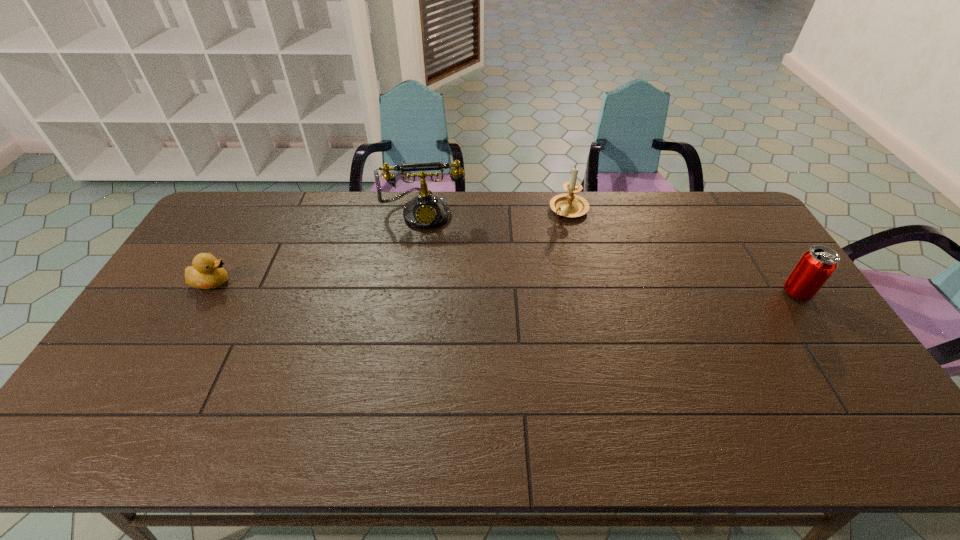
In order to click on vacant space located with a handle on the side of the third object from left to right in this screenshot , I will do `click(539, 241)`.

The width and height of the screenshot is (960, 540). I want to click on vacant space situated 0.210m on the dial of the third object from right to left, so click(x=425, y=273).

In order to click on vacant region located 0.290m on the dial of the third object from right to left in this screenshot , I will do `click(425, 292)`.

You are a GUI agent. You are given a task and a screenshot of the screen. Output one action in this format:
    pyautogui.click(x=<x>, y=<y>)
    Task: Click on the vacant space situated 0.390m on the dial of the third object from right to left
    
    Given the screenshot: What is the action you would take?
    pyautogui.click(x=425, y=318)

Locate an element on the screen. The height and width of the screenshot is (540, 960). candle holder that is positioned at the far edge is located at coordinates (568, 205).

Locate an element on the screen. telephone that is at the far edge is located at coordinates (425, 211).

Find the location of `object at the left edge`. object at the left edge is located at coordinates (207, 272).

I want to click on object located at the right edge, so click(817, 264).

In the image, there is a desktop. Where is `vacant space at the far edge`? vacant space at the far edge is located at coordinates (562, 230).

Locate an element on the screen. vacant region at the left edge of the desktop is located at coordinates (204, 312).